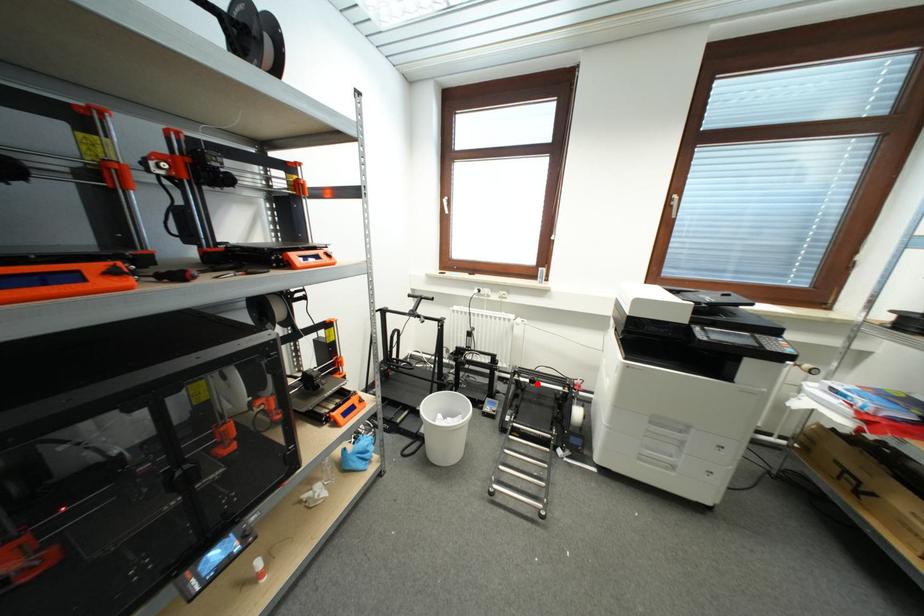
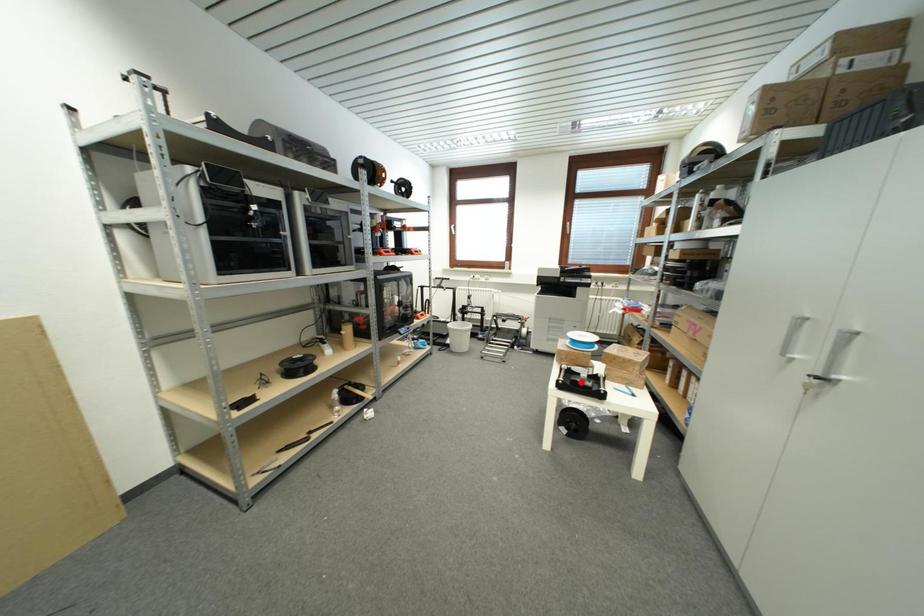
I am providing you with two images of the same scene from different viewpoints. A red point is marked on the first image and another point is marked on the second image. Is the red point in image1 aligned with the point shown in image2?

No